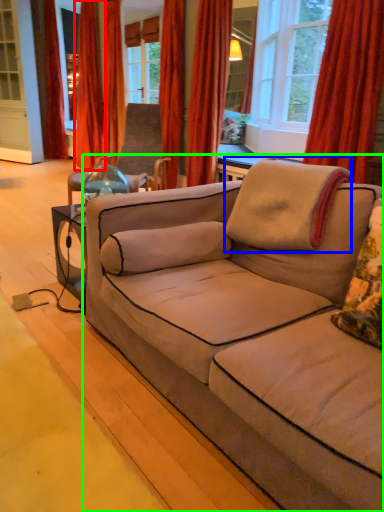
Question: Estimate the real-world distances between objects in this image. Which object is closer to curtain (highlighted by a red box), pillow (highlighted by a blue box) or studio couch (highlighted by a green box)?

Choices:
 (A) pillow
 (B) studio couch

Answer: (A)